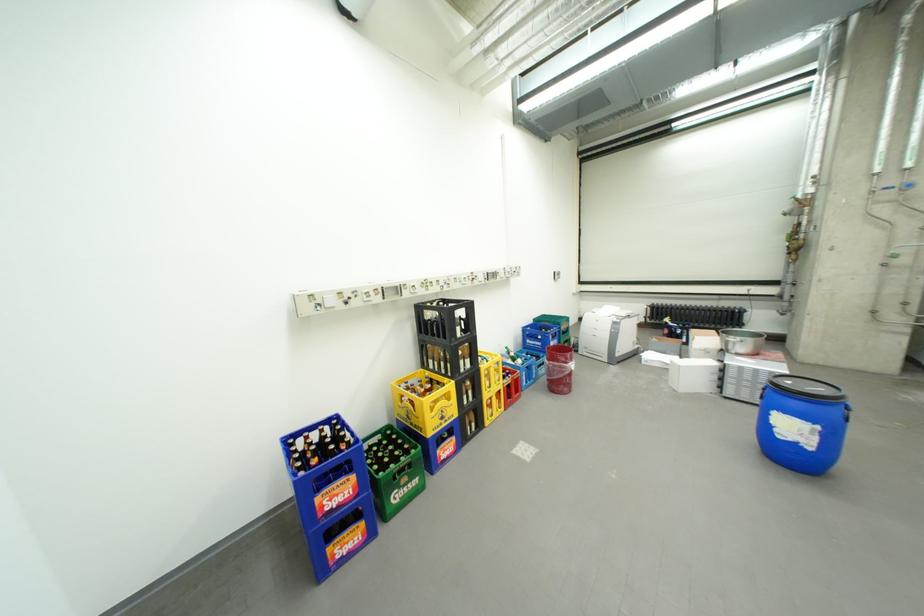
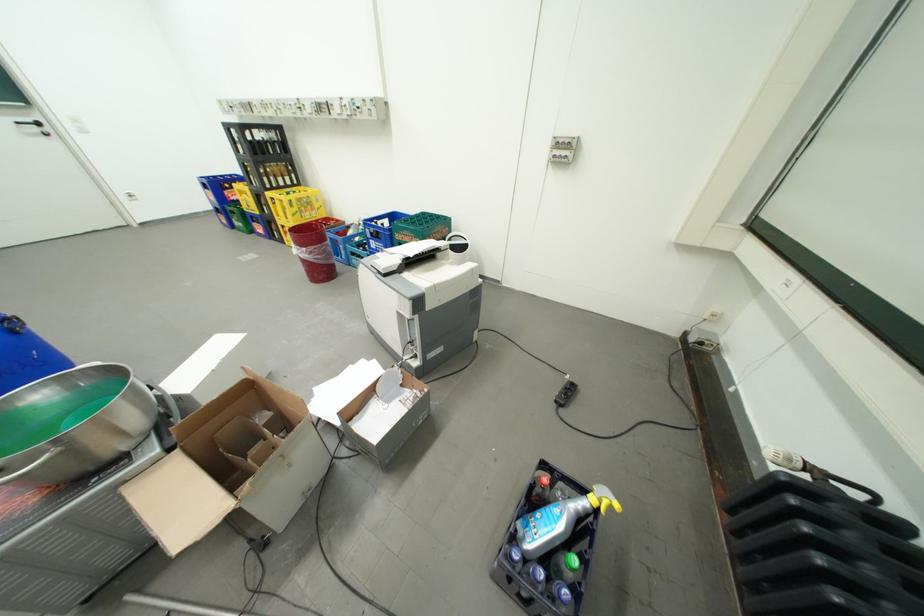
In the second image, find the point that corresponds to [562,344] in the first image.

(381, 241)